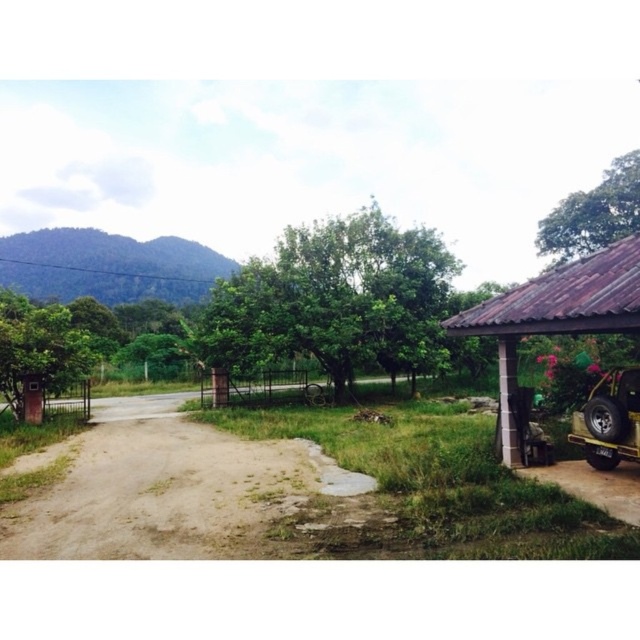
In the scene shown: You are a delivery driver who needs to park your metallic yellow jeep at lower right near the brown corrugated roof at right. Based on the scene, can you safely park the jeep so that it is directly under the roof without blocking the dirt path?

The brown corrugated roof at right is positioned on the left side of the metallic yellow jeep at lower right. Since the jeep is already at the lower right and the roof is to its left, parking directly under the roof would require moving the jeep leftward. However, the dirt path runs through the area, so moving the jeep might block it. Therefore, it might not be possible to park safely without obstructing the path.

You are a gardener planning to plant a new tree in the middle of the dirt path. The brown corrugated roof at right and the green leafy tree at left are in your way. Which object is closer to the path so you can decide where to plant?

The brown corrugated roof at right is positioned under the green leafy tree at left, meaning the brown corrugated roof at right is closer to the path. You should consider planting the new tree closer to the brown corrugated roof at right since it is nearer to the path.